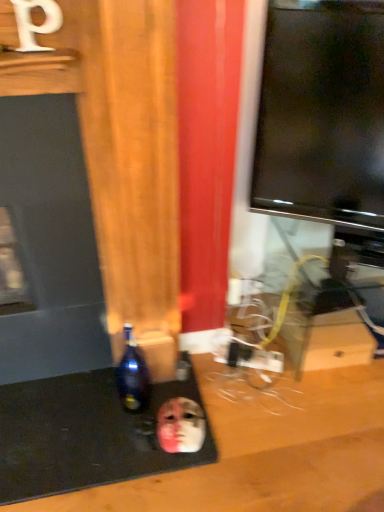
Measure the distance between point (145, 402) and camera.

The depth of point (145, 402) is 4.84 feet.

What do you see at coordinates (133, 376) in the screenshot? The image size is (384, 512). I see `dark blue glass bottle at lower left` at bounding box center [133, 376].

Image resolution: width=384 pixels, height=512 pixels. In order to click on dark blue glass bottle at lower left in this screenshot , I will do `click(133, 376)`.

You are a GUI agent. You are given a task and a screenshot of the screen. Output one action in this format:
    pyautogui.click(x=<x>, y=<y>)
    Task: Click on the smooth matte face at lower center
    The image size is (384, 512).
    Given the screenshot: What is the action you would take?
    pyautogui.click(x=181, y=426)

In order to face smooth matte face at lower center, should I rotate leftwards or rightwards?

Turn left approximately 1.476 degrees to face it.

Measure the distance between smooth matte face at lower center and camera.

smooth matte face at lower center is 1.33 meters from camera.

Describe the element at coordinates (181, 426) in the screenshot. This screenshot has width=384, height=512. I see `smooth matte face at lower center` at that location.

I want to click on dark blue glass bottle at lower left, so click(133, 376).

Considering the positions of objects smooth matte face at lower center and dark blue glass bottle at lower left in the image provided, who is more to the left, smooth matte face at lower center or dark blue glass bottle at lower left?

dark blue glass bottle at lower left.

Is smooth matte face at lower center in front of or behind dark blue glass bottle at lower left in the image?

smooth matte face at lower center is positioned farther from the viewer than dark blue glass bottle at lower left.

Which point is more distant from viewer, (179, 398) or (137, 407)?

The point (137, 407) is more distant.

From the image's perspective, which one is positioned lower, smooth matte face at lower center or dark blue glass bottle at lower left?

smooth matte face at lower center appears lower in the image.

From a real-world perspective, who is located lower, smooth matte face at lower center or dark blue glass bottle at lower left?

smooth matte face at lower center is physically lower.

Can you confirm if smooth matte face at lower center is wider than dark blue glass bottle at lower left?

Yes, smooth matte face at lower center is wider than dark blue glass bottle at lower left.

Considering the sizes of objects smooth matte face at lower center and dark blue glass bottle at lower left in the image provided, who is shorter, smooth matte face at lower center or dark blue glass bottle at lower left?

smooth matte face at lower center is shorter.

Considering the sizes of objects smooth matte face at lower center and dark blue glass bottle at lower left in the image provided, who is smaller, smooth matte face at lower center or dark blue glass bottle at lower left?

smooth matte face at lower center is smaller.

Would you say smooth matte face at lower center contains dark blue glass bottle at lower left?

Definitely not — dark blue glass bottle at lower left is not inside smooth matte face at lower center.

Is smooth matte face at lower center next to dark blue glass bottle at lower left and touching it?

smooth matte face at lower center and dark blue glass bottle at lower left are not in contact.

Is smooth matte face at lower center oriented towards dark blue glass bottle at lower left?

No, smooth matte face at lower center is not facing towards dark blue glass bottle at lower left.

Can you tell me how much smooth matte face at lower center and dark blue glass bottle at lower left differ in facing direction?

11.8 degrees.

I want to click on bottle on the left of smooth matte face at lower center, so click(133, 376).

Between dark blue glass bottle at lower left and smooth matte face at lower center, which one appears on the right side from the viewer's perspective?

smooth matte face at lower center is more to the right.

Relative to smooth matte face at lower center, is dark blue glass bottle at lower left in front or behind?

Clearly, dark blue glass bottle at lower left is in front of smooth matte face at lower center.

Which is behind, point (146, 401) or point (158, 428)?

The point (146, 401) is farther from the camera.

From the image's perspective, would you say dark blue glass bottle at lower left is shown under smooth matte face at lower center?

Incorrect, from the image's perspective, dark blue glass bottle at lower left is higher than smooth matte face at lower center.

From a real-world perspective, is dark blue glass bottle at lower left physically below smooth matte face at lower center?

No, from a real-world perspective, dark blue glass bottle at lower left is not below smooth matte face at lower center.

Which of these two, dark blue glass bottle at lower left or smooth matte face at lower center, is wider?

smooth matte face at lower center.

Can you confirm if dark blue glass bottle at lower left is shorter than smooth matte face at lower center?

No, dark blue glass bottle at lower left is not shorter than smooth matte face at lower center.

In terms of size, does dark blue glass bottle at lower left appear bigger or smaller than smooth matte face at lower center?

dark blue glass bottle at lower left is bigger than smooth matte face at lower center.

Would you say dark blue glass bottle at lower left is inside or outside smooth matte face at lower center?

dark blue glass bottle at lower left is not inside smooth matte face at lower center, it's outside.

Is dark blue glass bottle at lower left placed right next to smooth matte face at lower center?

No, dark blue glass bottle at lower left is not making contact with smooth matte face at lower center.

Is dark blue glass bottle at lower left looking in the opposite direction of smooth matte face at lower center?

dark blue glass bottle at lower left is not turned away from smooth matte face at lower center.

What's the angular difference between dark blue glass bottle at lower left and smooth matte face at lower center's facing directions?

There is a 11.8-degree angle between the facing directions of dark blue glass bottle at lower left and smooth matte face at lower center.

At what (x,y) coordinates should I click in order to perform the action: click on human face on the right of dark blue glass bottle at lower left. Please return your answer as a coordinate pair (x, y). Looking at the image, I should click on (181, 426).

Where is `human face below the dark blue glass bottle at lower left (from the image's perspective)`? This screenshot has width=384, height=512. human face below the dark blue glass bottle at lower left (from the image's perspective) is located at coordinates (181, 426).

This screenshot has height=512, width=384. Find the location of `bottle above the smooth matte face at lower center (from a real-world perspective)`. bottle above the smooth matte face at lower center (from a real-world perspective) is located at coordinates (133, 376).